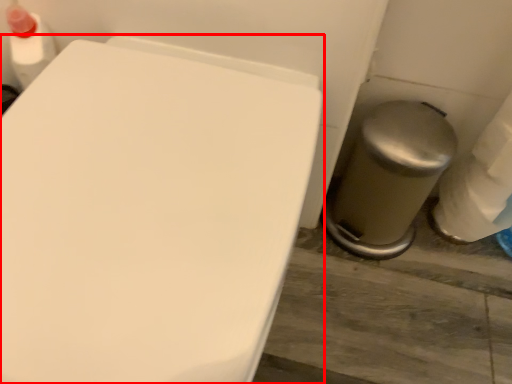
Question: In this image, where is toilet (annotated by the red box) located relative to porcelain?

Choices:
 (A) left
 (B) right

Answer: (A)